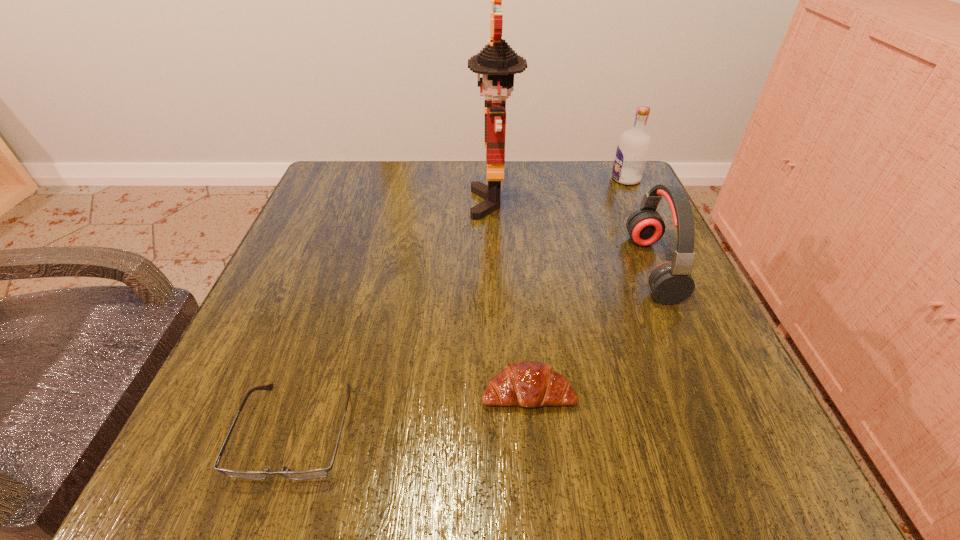
Where is `free spot that satisfies the following two spatial constraints: 1. on the front-facing side of the nutcracker; 2. on the back side of the second shortest object`? Image resolution: width=960 pixels, height=540 pixels. free spot that satisfies the following two spatial constraints: 1. on the front-facing side of the nutcracker; 2. on the back side of the second shortest object is located at coordinates (501, 392).

You are a GUI agent. You are given a task and a screenshot of the screen. Output one action in this format:
    pyautogui.click(x=<x>, y=<y>)
    Task: Click on the vacant space that satisfies the following two spatial constraints: 1. on the front-facing side of the tallest object; 2. on the front-facing side of the shortest object
    The image size is (960, 540).
    Given the screenshot: What is the action you would take?
    pyautogui.click(x=503, y=431)

Where is `free space that satisfies the following two spatial constraints: 1. on the front-facing side of the tallest object; 2. on the left side of the crescent roll`? The height and width of the screenshot is (540, 960). free space that satisfies the following two spatial constraints: 1. on the front-facing side of the tallest object; 2. on the left side of the crescent roll is located at coordinates (501, 392).

This screenshot has height=540, width=960. What are the coordinates of `free space that satisfies the following two spatial constraints: 1. on the front-facing side of the nutcracker; 2. on the front-facing side of the spectacles` in the screenshot? It's located at (503, 431).

I want to click on vacant point that satisfies the following two spatial constraints: 1. on the front-facing side of the tallest object; 2. on the left side of the fourth tallest object, so click(x=501, y=392).